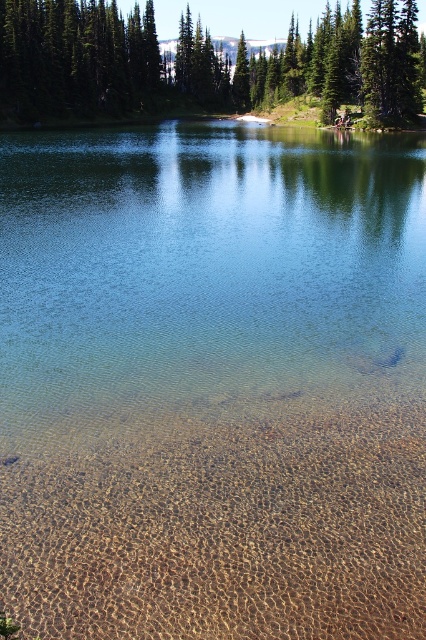
Question: Among these objects, which one is farthest from the camera?

Choices:
 (A) green matte tree at upper center
 (B) green textured tree at upper center
 (C) clear sand at bottom
 (D) clear water at center

Answer: (A)

Question: Among these points, which one is nearest to the camera?

Choices:
 (A) (330, 358)
 (B) (278, 97)
 (C) (235, 611)
 (D) (36, 88)

Answer: (C)

Question: Can you confirm if clear sand at bottom is positioned above green textured tree at upper center?

Choices:
 (A) yes
 (B) no

Answer: (B)

Question: Does green textured tree at upper center appear on the right side of green matte tree at upper center?

Choices:
 (A) yes
 (B) no

Answer: (B)

Question: Is clear sand at bottom thinner than green matte tree at upper center?

Choices:
 (A) yes
 (B) no

Answer: (A)

Question: Among these objects, which one is nearest to the camera?

Choices:
 (A) green matte tree at upper center
 (B) green textured tree at upper center
 (C) clear water at center

Answer: (C)